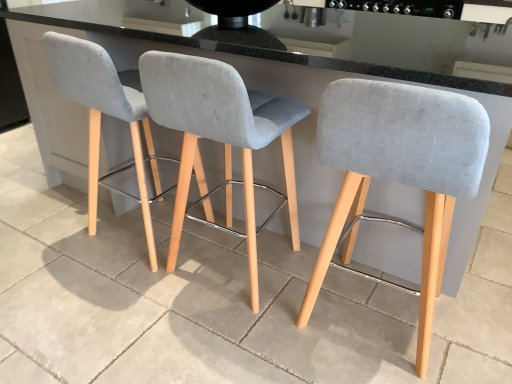
Question: Which direction should I rotate to face light gray fabric stool at center, the 2th chair positioned from the right, — up or down?

Choices:
 (A) up
 (B) down

Answer: (A)

Question: Is light gray fabric stool at center, placed as the second chair when sorted from left to right, directly adjacent to gray concrete at center?

Choices:
 (A) yes
 (B) no

Answer: (B)

Question: Considering the relative sizes of light gray fabric stool at center, placed as the second chair when sorted from left to right, and gray concrete at center in the image provided, is light gray fabric stool at center, placed as the second chair when sorted from left to right, shorter than gray concrete at center?

Choices:
 (A) no
 (B) yes

Answer: (A)

Question: From the image's perspective, is light gray fabric stool at center, placed as the second chair when sorted from left to right, above gray concrete at center?

Choices:
 (A) yes
 (B) no

Answer: (A)

Question: Does light gray fabric stool at center, placed as the second chair when sorted from left to right, lie in front of gray concrete at center?

Choices:
 (A) no
 (B) yes

Answer: (B)

Question: Is light gray fabric stool at center, placed as the second chair when sorted from left to right, positioned beyond the bounds of gray concrete at center?

Choices:
 (A) no
 (B) yes

Answer: (B)

Question: Is light gray fabric stool at center, the 2th chair positioned from the right, behind gray concrete at center?

Choices:
 (A) no
 (B) yes

Answer: (A)

Question: Is gray concrete at center looking in the opposite direction of light gray fabric stool at center, the 2th chair positioned from the right?

Choices:
 (A) yes
 (B) no

Answer: (B)

Question: From a real-world perspective, is gray concrete at center physically below light gray fabric stool at center, placed as the second chair when sorted from left to right?

Choices:
 (A) no
 (B) yes

Answer: (B)

Question: Is gray concrete at center in front of light gray fabric stool at center, placed as the second chair when sorted from left to right?

Choices:
 (A) no
 (B) yes

Answer: (A)

Question: From the image's perspective, does gray concrete at center appear higher than light gray fabric stool at center, placed as the second chair when sorted from left to right?

Choices:
 (A) no
 (B) yes

Answer: (A)

Question: Is gray concrete at center positioned far away from light gray fabric stool at center, placed as the second chair when sorted from left to right?

Choices:
 (A) no
 (B) yes

Answer: (A)

Question: Can you confirm if gray concrete at center is bigger than light gray fabric stool at center, placed as the second chair when sorted from left to right?

Choices:
 (A) no
 (B) yes

Answer: (A)

Question: Is light gray fabric stool at center, placed as the second chair when sorted from left to right, in front of black glossy stove at upper center?

Choices:
 (A) yes
 (B) no

Answer: (A)